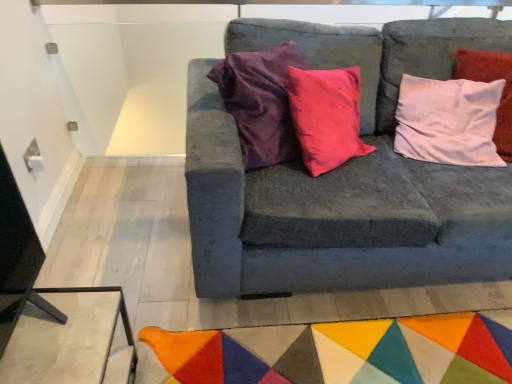
What do you see at coordinates (335, 352) in the screenshot? This screenshot has width=512, height=384. I see `multicolored felt mat at lower center` at bounding box center [335, 352].

You are a GUI agent. You are given a task and a screenshot of the screen. Output one action in this format:
    pyautogui.click(x=<x>, y=<y>)
    Task: Click on the multicolored felt mat at lower center
    The height and width of the screenshot is (384, 512).
    Given the screenshot: What is the action you would take?
    pyautogui.click(x=335, y=352)

You are a GUI agent. You are given a task and a screenshot of the screen. Output one action in this format:
    pyautogui.click(x=<x>, y=<y>)
    Task: Click on the velvet gray couch at center
    Image resolution: width=512 pixels, height=384 pixels.
    Given the screenshot: What is the action you would take?
    pyautogui.click(x=344, y=178)

Measure the distance between velvet gray couch at center and camera.

velvet gray couch at center and camera are 4.19 feet apart.

What do you see at coordinates (344, 178) in the screenshot?
I see `velvet gray couch at center` at bounding box center [344, 178].

What is the approximate width of velvet gray couch at center?

The width of velvet gray couch at center is 3.46 feet.

You are a GUI agent. You are given a task and a screenshot of the screen. Output one action in this format:
    pyautogui.click(x=<x>, y=<y>)
    Task: Click on the multicolored felt mat at lower center
    
    Given the screenshot: What is the action you would take?
    pyautogui.click(x=335, y=352)

Considering the relative positions of multicolored felt mat at lower center and velvet gray couch at center in the image provided, is multicolored felt mat at lower center to the left of velvet gray couch at center from the viewer's perspective?

Yes, multicolored felt mat at lower center is to the left of velvet gray couch at center.

Is the position of multicolored felt mat at lower center more distant than that of velvet gray couch at center?

That is True.

Considering the positions of point (200, 341) and point (274, 33), is point (200, 341) closer or farther from the camera than point (274, 33)?

Point (200, 341).

From the image's perspective, is multicolored felt mat at lower center positioned above or below velvet gray couch at center?

multicolored felt mat at lower center is below velvet gray couch at center.

From a real-world perspective, between multicolored felt mat at lower center and velvet gray couch at center, who is vertically higher?

In real-world perspective, velvet gray couch at center is above.

Which of these two, multicolored felt mat at lower center or velvet gray couch at center, is thinner?

With smaller width is velvet gray couch at center.

Between multicolored felt mat at lower center and velvet gray couch at center, which one has more height?

With more height is velvet gray couch at center.

Which of these two, multicolored felt mat at lower center or velvet gray couch at center, is smaller?

With smaller size is multicolored felt mat at lower center.

Choose the correct answer: Is multicolored felt mat at lower center inside velvet gray couch at center or outside it?

multicolored felt mat at lower center exists outside the volume of velvet gray couch at center.

Is multicolored felt mat at lower center not close to velvet gray couch at center?

multicolored felt mat at lower center is actually quite close to velvet gray couch at center.

Does multicolored felt mat at lower center turn towards velvet gray couch at center?

No, multicolored felt mat at lower center is not turned towards velvet gray couch at center.

How different are the orientations of multicolored felt mat at lower center and velvet gray couch at center in degrees?

The angular difference between multicolored felt mat at lower center and velvet gray couch at center is 88 degrees.

Measure the distance from multicolored felt mat at lower center to velvet gray couch at center.

multicolored felt mat at lower center and velvet gray couch at center are 19.89 inches apart from each other.

Identify the location of studio couch in front of the multicolored felt mat at lower center. Image resolution: width=512 pixels, height=384 pixels. (344, 178).

Which is more to the left, velvet gray couch at center or multicolored felt mat at lower center?

multicolored felt mat at lower center.

Which object is further away from the camera, velvet gray couch at center or multicolored felt mat at lower center?

multicolored felt mat at lower center is behind.

Between point (353, 249) and point (448, 380), which one is positioned behind?

The point (353, 249) is more distant.

From the image's perspective, is velvet gray couch at center below multicolored felt mat at lower center?

No, from the image's perspective, velvet gray couch at center is not below multicolored felt mat at lower center.

From a real-world perspective, is velvet gray couch at center physically below multicolored felt mat at lower center?

Incorrect, from a real-world perspective, velvet gray couch at center is higher than multicolored felt mat at lower center.

Does velvet gray couch at center have a lesser width compared to multicolored felt mat at lower center?

Yes.

Between velvet gray couch at center and multicolored felt mat at lower center, which one has less height?

multicolored felt mat at lower center.

Considering the sizes of objects velvet gray couch at center and multicolored felt mat at lower center in the image provided, who is smaller, velvet gray couch at center or multicolored felt mat at lower center?

With smaller size is multicolored felt mat at lower center.

In the scene shown: Can we say velvet gray couch at center lies outside multicolored felt mat at lower center?

Yes, velvet gray couch at center is not within multicolored felt mat at lower center.

Is velvet gray couch at center placed right next to multicolored felt mat at lower center?

They are not placed beside each other.

Is velvet gray couch at center oriented towards multicolored felt mat at lower center?

Yes, velvet gray couch at center is aimed at multicolored felt mat at lower center.

How different are the orientations of velvet gray couch at center and multicolored felt mat at lower center in degrees?

88 degrees separate the facing orientations of velvet gray couch at center and multicolored felt mat at lower center.

I want to click on studio couch that appears in front of the multicolored felt mat at lower center, so (x=344, y=178).

The height and width of the screenshot is (384, 512). Find the location of `mat beneath the velvet gray couch at center (from a real-world perspective)`. mat beneath the velvet gray couch at center (from a real-world perspective) is located at coordinates pyautogui.click(x=335, y=352).

Where is `studio couch in front of the multicolored felt mat at lower center`? studio couch in front of the multicolored felt mat at lower center is located at coordinates (344, 178).